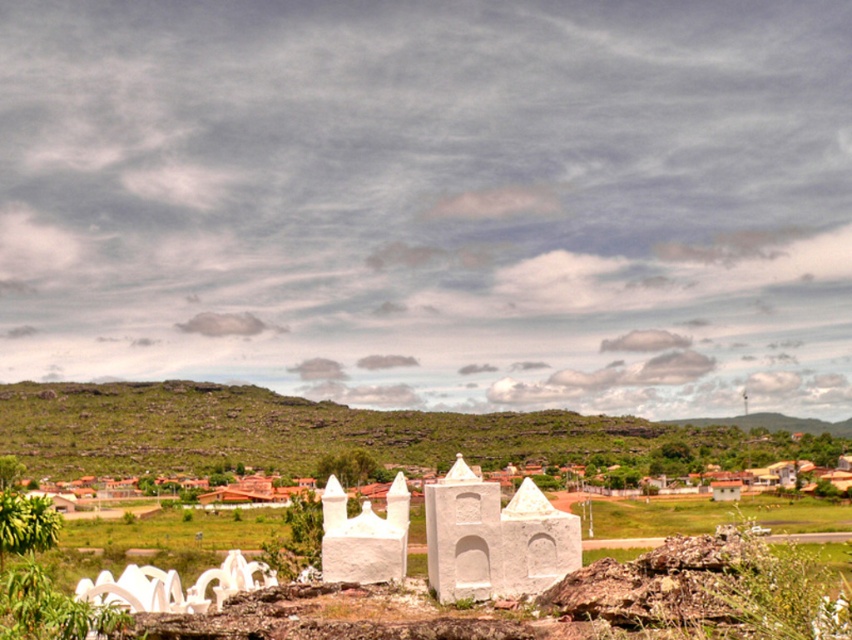
Who is positioned more to the right, green grassy hillside at lower center or white stone chapel at center?

white stone chapel at center is more to the right.

Does point (602, 433) come closer to viewer compared to point (465, 586)?

No, it is not.

At what (x,y) coordinates should I click in order to perform the action: click on green grassy hillside at lower center. Please return your answer as a coordinate pair (x, y). This screenshot has height=640, width=852. Looking at the image, I should click on (341, 433).